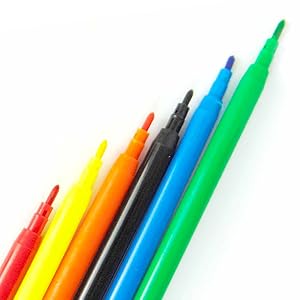
The width and height of the screenshot is (300, 300). I want to click on markers, so click(19, 244), click(49, 244), click(82, 246), click(111, 246), click(141, 248), click(167, 256).